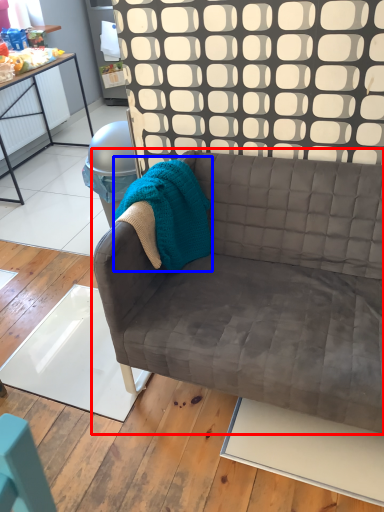
Question: Which of the following is the farthest to the observer, studio couch (highlighted by a red box) or blanket (highlighted by a blue box)?

Choices:
 (A) studio couch
 (B) blanket

Answer: (B)